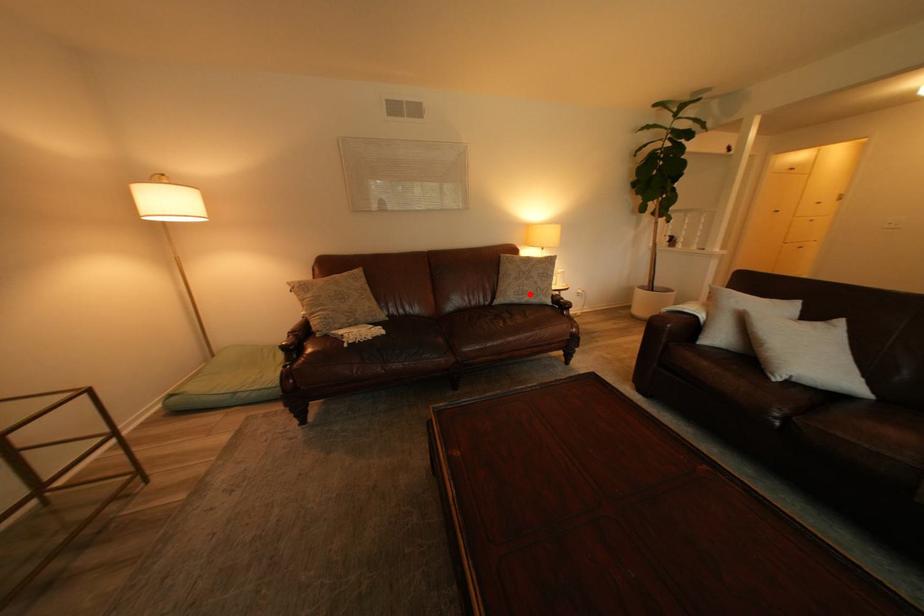
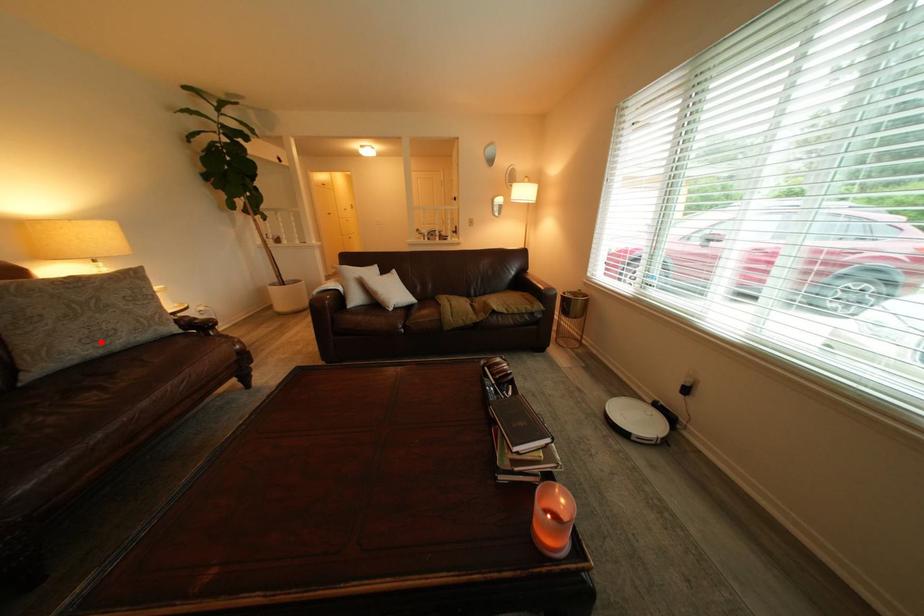
I am providing you with two images of the same scene from different viewpoints. A red point is marked on the first image and another point is marked on the second image. Do the highlighted points in image1 and image2 indicate the same real-world spot?

Yes